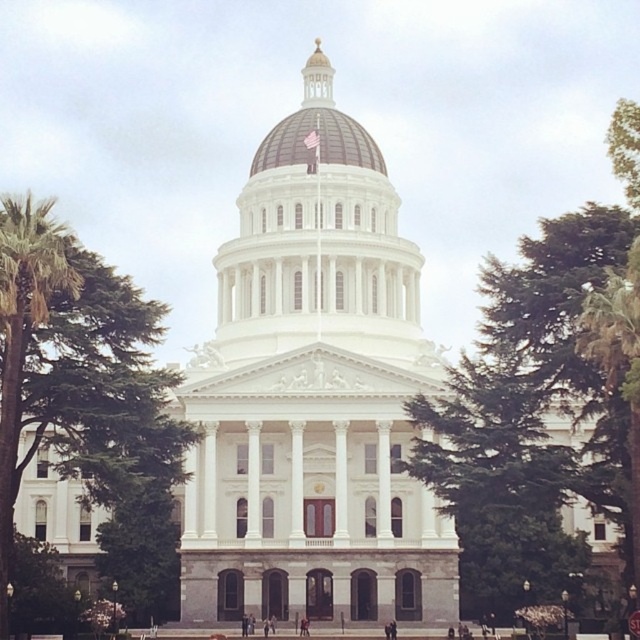
Is green leafy tree at center further to camera compared to brown domed roof at center?

That is False.

Can you confirm if green leafy tree at center is positioned to the left of brown domed roof at center?

Incorrect, green leafy tree at center is not on the left side of brown domed roof at center.

This screenshot has width=640, height=640. In order to click on green leafy tree at center in this screenshot , I will do `click(548, 380)`.

At what (x,y) coordinates should I click in order to perform the action: click on green leafy tree at center. Please return your answer as a coordinate pair (x, y). The height and width of the screenshot is (640, 640). Looking at the image, I should click on (548, 380).

How far apart are green leafy tree at center and green leafy tree at left?

They are 17.56 meters apart.

Is green leafy tree at center above green leafy tree at left?

Indeed, green leafy tree at center is positioned over green leafy tree at left.

Between point (625, 378) and point (164, 458), which one is positioned in front?

Point (625, 378)

Find the location of a particular element. green leafy tree at center is located at coordinates (548, 380).

Does green leafy tree at left appear on the right side of brown domed roof at center?

In fact, green leafy tree at left is to the left of brown domed roof at center.

Does green leafy tree at left appear over brown domed roof at center?

Incorrect, green leafy tree at left is not positioned above brown domed roof at center.

Is point (20, 403) farther from camera compared to point (256, 163)?

No, (20, 403) is closer to viewer.

Find the location of `green leafy tree at left`. green leafy tree at left is located at coordinates (76, 369).